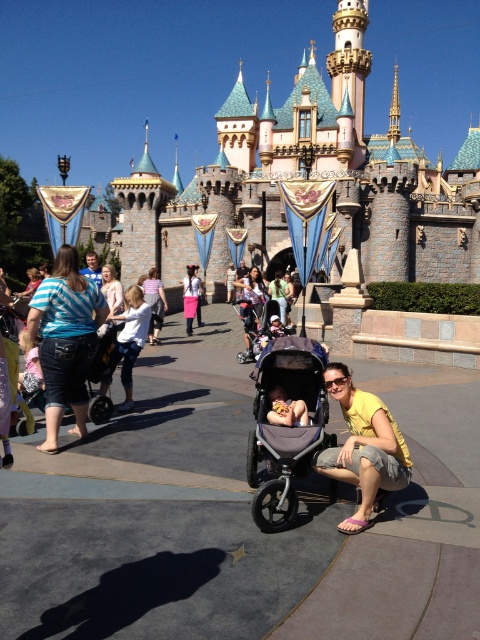
Question: Which of the following is the closest to the observer?

Choices:
 (A) soft beige baby at center
 (B) blue striped shirt at left
 (C) matte pink shirt at center

Answer: (A)

Question: Which object is positioned farthest from the pink fabric skirt at center?

Choices:
 (A) yellow cotton shirt at lower center
 (B) blue striped shirt at left

Answer: (A)

Question: Is blue striped shirt at left bigger than matte pink shirt at center?

Choices:
 (A) no
 (B) yes

Answer: (A)

Question: Which of these objects is positioned closest to the pink fabric skirt at center?

Choices:
 (A) pink stone castle at center
 (B) matte pink shirt at center

Answer: (B)

Question: Is gray fabric stroller at center thinner than pink fabric skirt at center?

Choices:
 (A) yes
 (B) no

Answer: (B)

Question: Can you confirm if gray fabric stroller at center is positioned above soft beige baby at center?

Choices:
 (A) no
 (B) yes

Answer: (A)